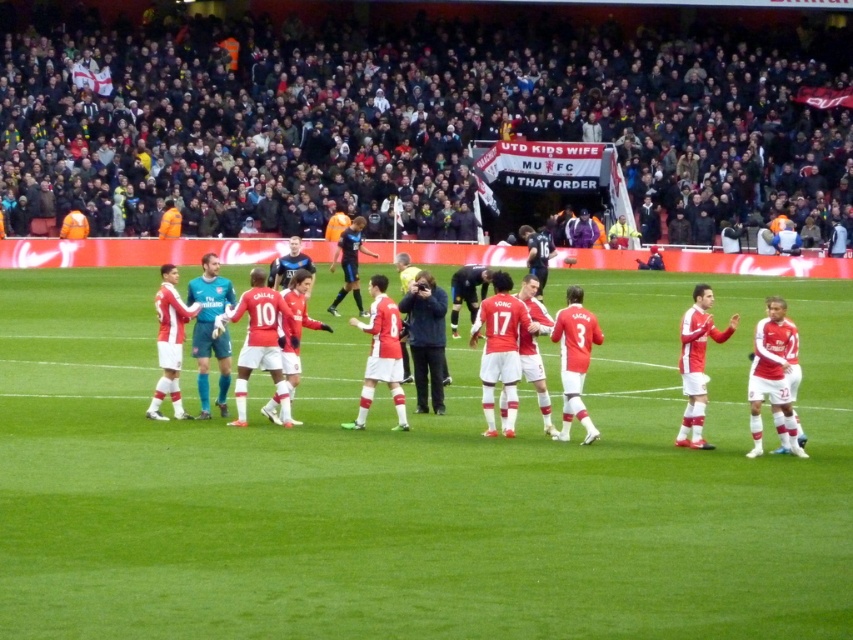
Which is in front, point (120, 534) or point (596, 266)?

Positioned in front is point (120, 534).

Is point (134, 515) less distant than point (552, 339)?

That is True.

Image resolution: width=853 pixels, height=640 pixels. Find the location of `red matte soccer field at center`. red matte soccer field at center is located at coordinates (416, 486).

Between red matte soccer field at center and matte black camera at center, which one is positioned higher?

Positioned higher is matte black camera at center.

Is point (358, 484) less distant than point (451, 294)?

Yes, point (358, 484) is in front of point (451, 294).

You are a GUI agent. You are given a task and a screenshot of the screen. Output one action in this format:
    pyautogui.click(x=<x>, y=<y>)
    Task: Click on the red matte soccer field at center
    The width and height of the screenshot is (853, 640).
    Given the screenshot: What is the action you would take?
    pyautogui.click(x=416, y=486)

How distant is red matte soccer team at center from dark blue jacket at center?

red matte soccer team at center and dark blue jacket at center are 9.70 feet apart from each other.

Is red matte soccer team at center to the right of dark blue jacket at center from the viewer's perspective?

Indeed, red matte soccer team at center is positioned on the right side of dark blue jacket at center.

Where is `red matte soccer team at center`? red matte soccer team at center is located at coordinates (775, 380).

At what (x,y) coordinates should I click in order to perform the action: click on red matte soccer team at center. Please return your answer as a coordinate pair (x, y). The height and width of the screenshot is (640, 853). Looking at the image, I should click on (775, 380).